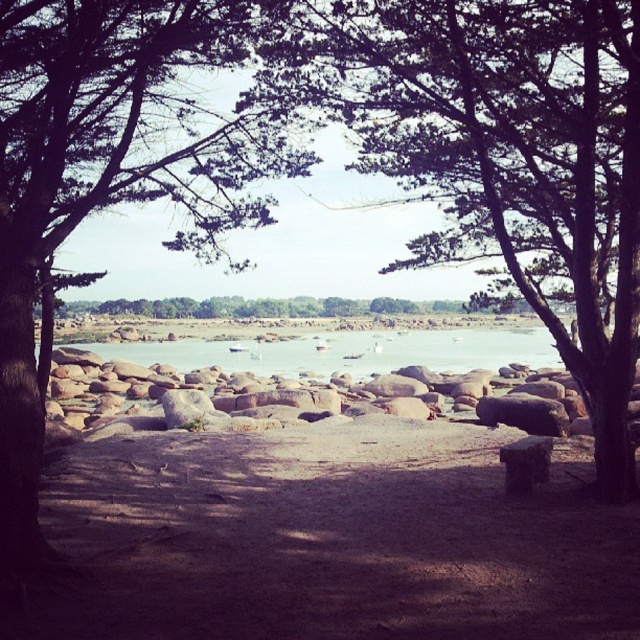
Question: Is brown sandy dirt at center positioned in front of clear water at center?

Choices:
 (A) yes
 (B) no

Answer: (A)

Question: Which of the following is the farthest from the observer?

Choices:
 (A) (65, 212)
 (B) (241, 365)
 (C) (512, 33)

Answer: (B)

Question: Which of the following is the closest to the observer?

Choices:
 (A) clear water at center
 (B) green leafy tree at left
 (C) green leafy tree at center

Answer: (B)

Question: From the image, what is the correct spatial relationship of brown sandy dirt at center in relation to clear water at center?

Choices:
 (A) above
 (B) below

Answer: (B)

Question: Can you confirm if green leafy tree at center is smaller than green leafy tree at left?

Choices:
 (A) yes
 (B) no

Answer: (B)

Question: Which object is closer to the camera taking this photo?

Choices:
 (A) green leafy tree at center
 (B) brown sandy dirt at center
 (C) green leafy tree at left
 (D) clear water at center

Answer: (C)